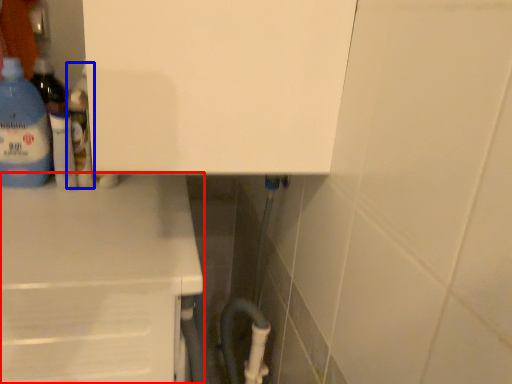
Question: Which of the following is the farthest to the observer, counter (highlighted by a red box) or bottle (highlighted by a blue box)?

Choices:
 (A) counter
 (B) bottle

Answer: (B)